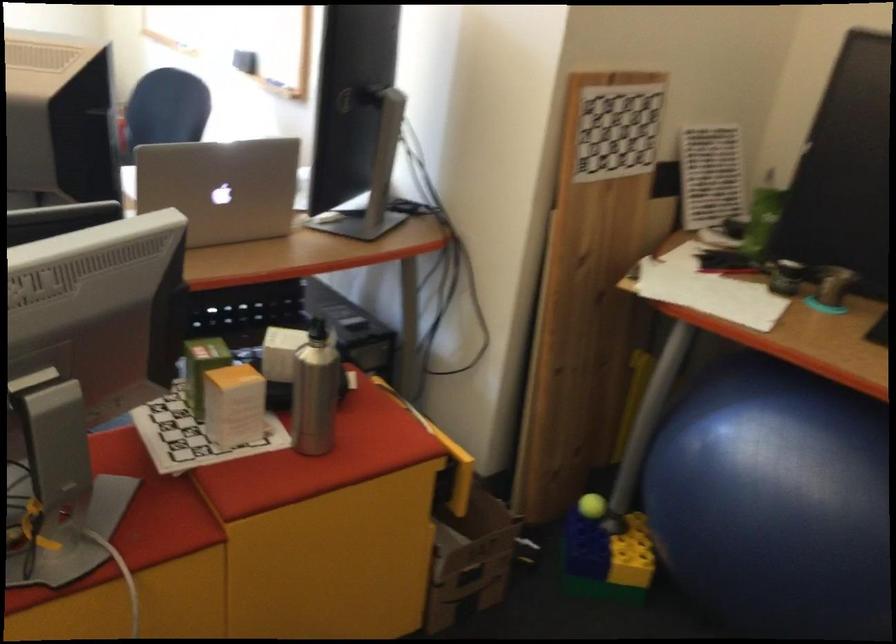
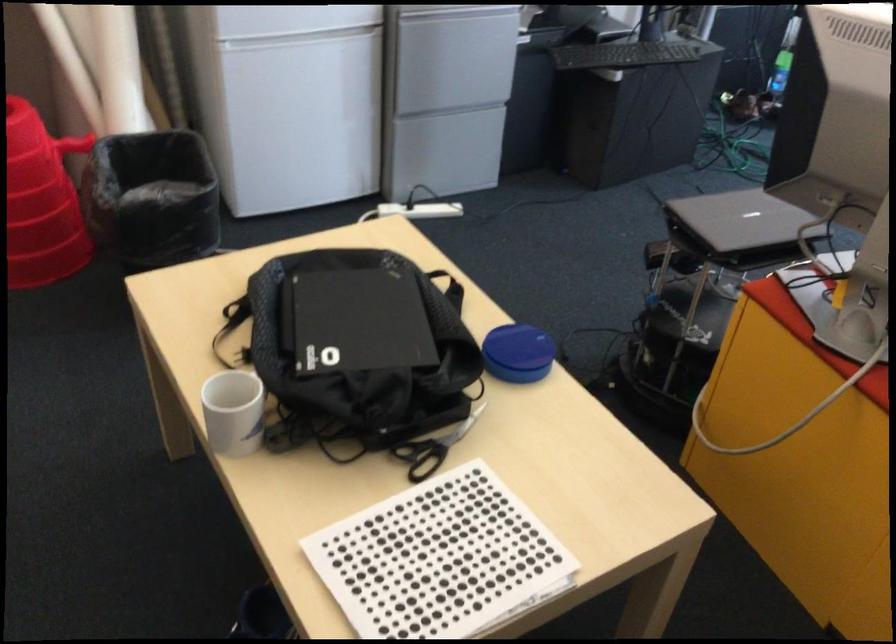
The images are taken continuously from a first-person perspective. In which direction is your viewpoint rotating?

The rotation direction of the camera is left-down.